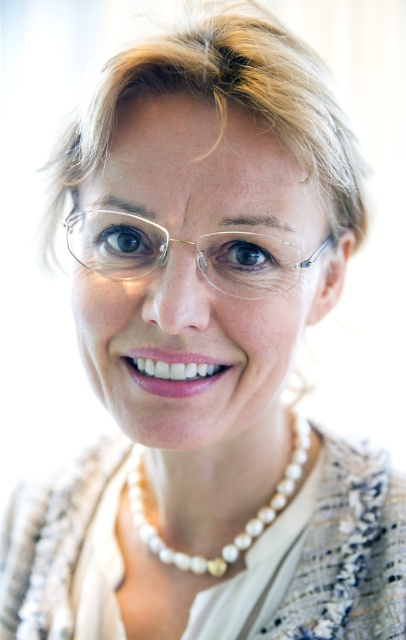
Does pearl necklace at center lie behind blue glossy eye at center?

Yes, it is.

Does pearl necklace at center have a greater width compared to blue glossy eye at center?

Yes, pearl necklace at center is wider than blue glossy eye at center.

Is point (151, 545) farther from camera compared to point (233, 257)?

Yes, it is.

Locate an element on the screen. Image resolution: width=406 pixels, height=640 pixels. pearl necklace at center is located at coordinates (244, 524).

Between clear plastic glasses at center and brown glossy eye at center, which one has less height?

With less height is brown glossy eye at center.

Between clear plastic glasses at center and brown glossy eye at center, which one is positioned higher?

Positioned higher is brown glossy eye at center.

Which is in front, point (252, 262) or point (120, 243)?

Positioned in front is point (252, 262).

Where is `clear plastic glasses at center`? This screenshot has width=406, height=640. clear plastic glasses at center is located at coordinates (185, 243).

Does clear plastic glasses at center appear on the right side of pearl necklace at center?

No, clear plastic glasses at center is not to the right of pearl necklace at center.

Is point (237, 237) positioned after point (278, 497)?

That is False.

Locate an element on the screen. clear plastic glasses at center is located at coordinates (185, 243).